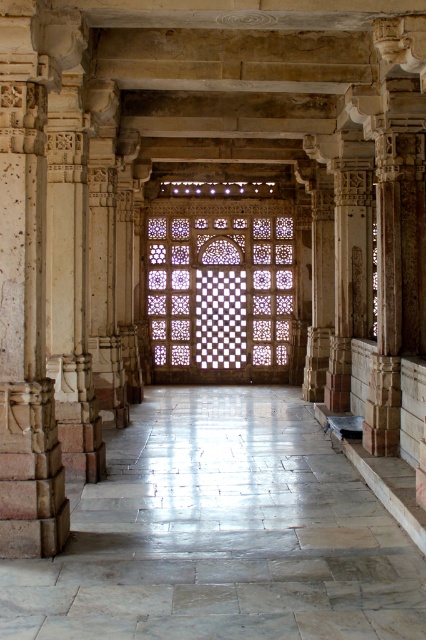
Question: Which point is farther from the camera taking this photo?

Choices:
 (A) (74, 508)
 (B) (189, 371)

Answer: (B)

Question: Which point is closer to the camera?

Choices:
 (A) (186, 333)
 (B) (331, 531)

Answer: (B)

Question: Can you confirm if white marble corridor at center is positioned to the left of translucent stone lattice at center?

Choices:
 (A) yes
 (B) no

Answer: (B)

Question: Is white marble corridor at center thinner than translucent stone lattice at center?

Choices:
 (A) no
 (B) yes

Answer: (A)

Question: Is white marble corridor at center closer to camera compared to translucent stone lattice at center?

Choices:
 (A) no
 (B) yes

Answer: (B)